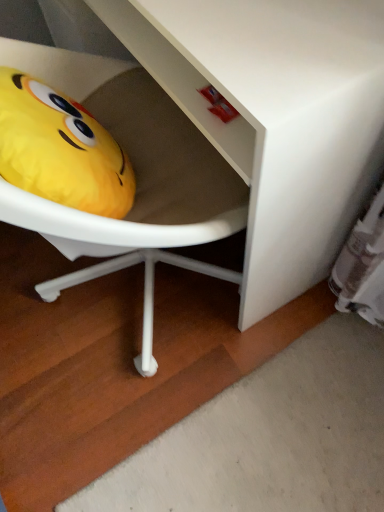
Question: From the image's perspective, is white matte vanity at lower left positioned above or below yellow plush toy at left?

Choices:
 (A) below
 (B) above

Answer: (B)

Question: Is point (292, 42) closer or farther from the camera than point (54, 198)?

Choices:
 (A) farther
 (B) closer

Answer: (B)

Question: Is white matte vanity at lower left wider or thinner than yellow plush toy at left?

Choices:
 (A) wide
 (B) thin

Answer: (A)

Question: Considering the relative positions of yellow plush toy at left and white matte vanity at lower left in the image provided, is yellow plush toy at left to the left or to the right of white matte vanity at lower left?

Choices:
 (A) left
 (B) right

Answer: (A)

Question: Relative to white matte vanity at lower left, is yellow plush toy at left in front or behind?

Choices:
 (A) behind
 (B) front

Answer: (A)

Question: From the image's perspective, relative to white matte vanity at lower left, is yellow plush toy at left above or below?

Choices:
 (A) below
 (B) above

Answer: (A)

Question: Does point (44, 139) appear closer or farther from the camera than point (319, 217)?

Choices:
 (A) farther
 (B) closer

Answer: (B)